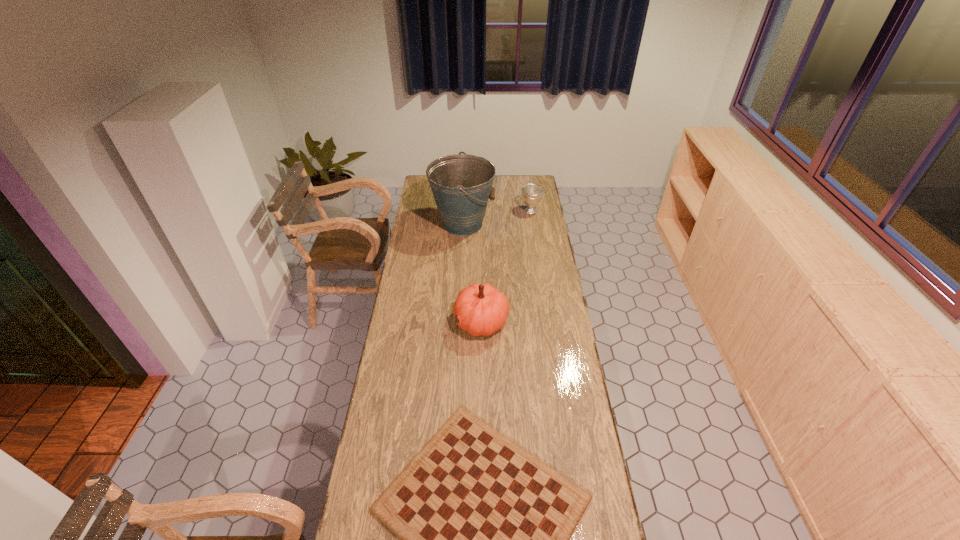
Identify the location of bucket. The height and width of the screenshot is (540, 960). (461, 185).

Locate an element on the screen. The image size is (960, 540). pumpkin is located at coordinates (481, 309).

Where is `the second nearest object`? The image size is (960, 540). the second nearest object is located at coordinates (481, 309).

I want to click on chalice, so click(531, 193).

Where is `free space located 0.100m with the handle on opposite sides of the tallest object`? free space located 0.100m with the handle on opposite sides of the tallest object is located at coordinates point(513,224).

Image resolution: width=960 pixels, height=540 pixels. I want to click on vacant space located 0.150m on the front-facing side of the second tallest object, so click(420, 321).

What are the coordinates of `free space located 0.190m on the front-facing side of the second tallest object` in the screenshot? It's located at (410, 321).

Locate an element on the screen. The height and width of the screenshot is (540, 960). vacant space located on the front-facing side of the second tallest object is located at coordinates (440, 321).

The width and height of the screenshot is (960, 540). I want to click on blank area located on the back of the chalice, so click(527, 190).

Where is `object that is at the left edge`? The height and width of the screenshot is (540, 960). object that is at the left edge is located at coordinates (461, 185).